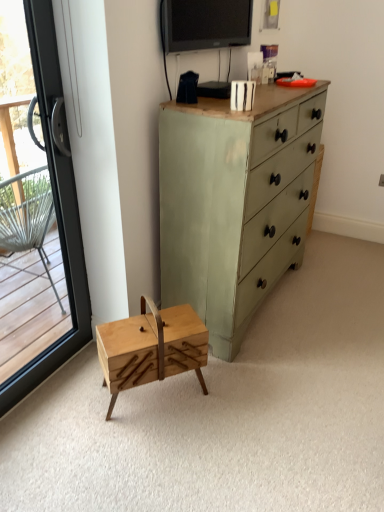
Question: Is matte black tv at upper center thinner than natural wood sewing box at center?

Choices:
 (A) yes
 (B) no

Answer: (A)

Question: From a real-world perspective, is matte black tv at upper center below natural wood sewing box at center?

Choices:
 (A) no
 (B) yes

Answer: (A)

Question: From the image's perspective, is matte black tv at upper center below natural wood sewing box at center?

Choices:
 (A) yes
 (B) no

Answer: (B)

Question: Does matte black tv at upper center have a greater width compared to natural wood sewing box at center?

Choices:
 (A) yes
 (B) no

Answer: (B)

Question: Is matte black tv at upper center next to natural wood sewing box at center and touching it?

Choices:
 (A) yes
 (B) no

Answer: (B)

Question: Is matte black tv at upper center oriented towards natural wood sewing box at center?

Choices:
 (A) yes
 (B) no

Answer: (B)

Question: Is natural wood sewing box at center turned away from matte black tv at upper center?

Choices:
 (A) no
 (B) yes

Answer: (A)

Question: From a real-world perspective, is natural wood sewing box at center located higher than matte black tv at upper center?

Choices:
 (A) no
 (B) yes

Answer: (A)

Question: Considering the relative sizes of natural wood sewing box at center and matte black tv at upper center in the image provided, is natural wood sewing box at center bigger than matte black tv at upper center?

Choices:
 (A) no
 (B) yes

Answer: (B)

Question: Is natural wood sewing box at center oriented towards matte black tv at upper center?

Choices:
 (A) yes
 (B) no

Answer: (B)

Question: Is natural wood sewing box at center closer to the viewer compared to matte black tv at upper center?

Choices:
 (A) yes
 (B) no

Answer: (A)

Question: Is natural wood sewing box at center shorter than matte black tv at upper center?

Choices:
 (A) no
 (B) yes

Answer: (A)

Question: From a real-world perspective, does transparent glass door at left sit lower than green painted wood chest of drawers at center?

Choices:
 (A) yes
 (B) no

Answer: (B)